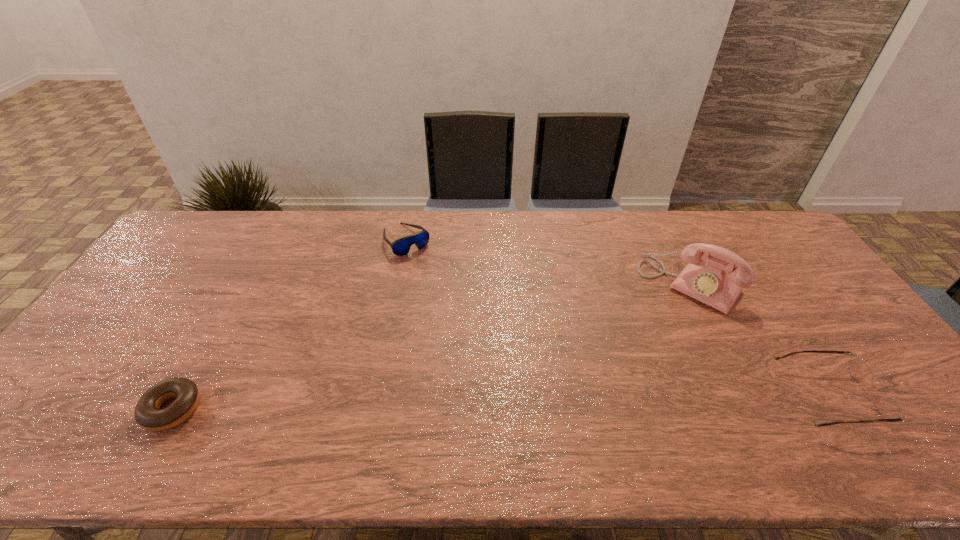
Where is `free space located on the front-facing side of the second object from left to right`? free space located on the front-facing side of the second object from left to right is located at coordinates (469, 321).

Identify the location of free space located on the front-facing side of the second object from left to right. (433, 276).

The width and height of the screenshot is (960, 540). I want to click on free space located 0.080m on the front-facing side of the second object from left to right, so click(x=427, y=269).

At what (x,y) coordinates should I click in order to perform the action: click on object that is at the far edge. Please return your answer as a coordinate pair (x, y). Looking at the image, I should click on (400, 247).

The width and height of the screenshot is (960, 540). I want to click on doughnut located in the near edge section of the desktop, so point(148,414).

Identify the location of spectacles that is at the near edge. click(888, 409).

Where is `object that is at the right edge`? Image resolution: width=960 pixels, height=540 pixels. object that is at the right edge is located at coordinates (888, 409).

Locate an element on the screen. This screenshot has height=540, width=960. object present at the near right corner is located at coordinates (888, 409).

In the image, there is a desktop. Where is `vacant space at the far edge`? The image size is (960, 540). vacant space at the far edge is located at coordinates (246, 218).

In order to click on vacant space at the near edge in this screenshot , I will do `click(456, 420)`.